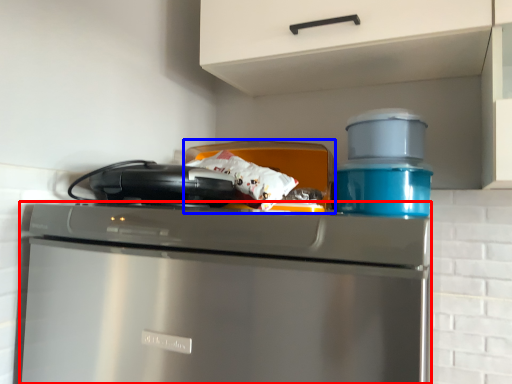
Question: Which point is closer to the camera, home appliance (highlighted by a red box) or appliance (highlighted by a blue box)?

Choices:
 (A) home appliance
 (B) appliance

Answer: (A)